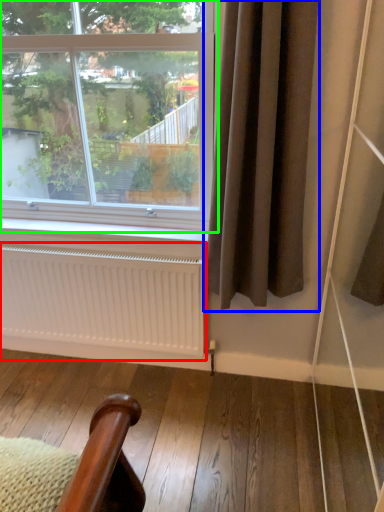
Question: Which object is positioned farthest from radiator (highlighted by a red box)? Select from curtain (highlighted by a blue box) and window (highlighted by a green box).

Choices:
 (A) curtain
 (B) window

Answer: (B)